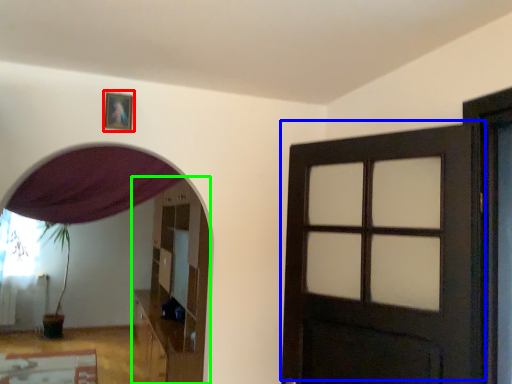
Question: Based on their relative distances, which object is nearer to picture frame (highlighted by a red box)? Choose from door (highlighted by a blue box) and dresser (highlighted by a green box).

Choices:
 (A) door
 (B) dresser

Answer: (A)